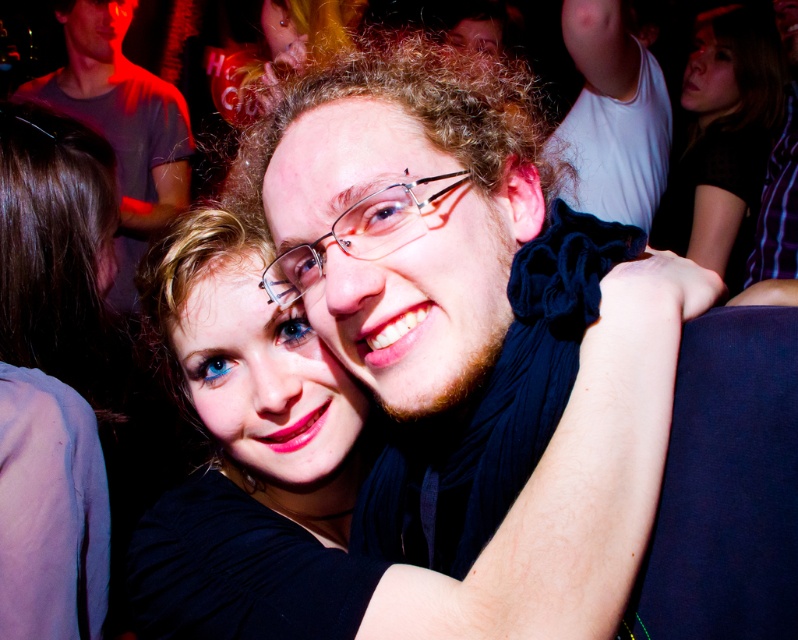
Does gray cotton t-shirt at upper left have a greater height compared to clear plastic glasses at center?

Yes.

Between point (117, 147) and point (350, 208), which one is positioned behind?

The point (117, 147) is more distant.

Who is more forward, (34, 84) or (361, 198)?

Point (361, 198) is more forward.

The height and width of the screenshot is (640, 798). I want to click on gray cotton t-shirt at upper left, so click(121, 125).

Can you confirm if matte black scarf at center is smaller than clear plastic glasses at center?

No, matte black scarf at center is not smaller than clear plastic glasses at center.

The image size is (798, 640). I want to click on matte black scarf at center, so click(x=461, y=310).

Is matte black scarf at center below smooth pink shirt at left?

Actually, matte black scarf at center is above smooth pink shirt at left.

This screenshot has height=640, width=798. In order to click on matte black scarf at center in this screenshot , I will do `click(461, 310)`.

The height and width of the screenshot is (640, 798). In order to click on matte black scarf at center in this screenshot , I will do `click(461, 310)`.

Find the location of a particular element. matte black scarf at center is located at coordinates (461, 310).